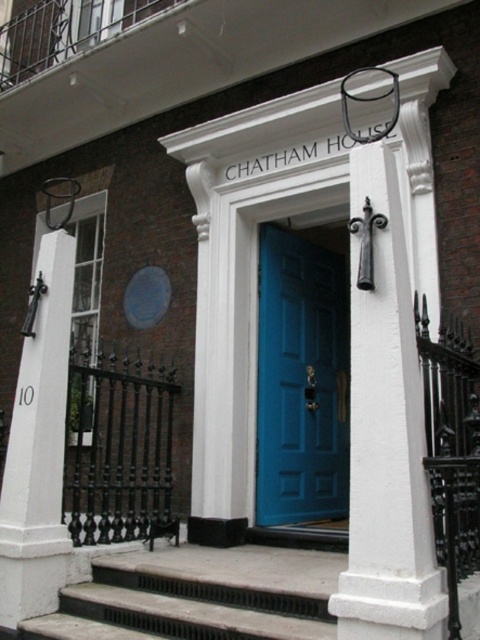
You are a delivery person with a cart that is 2 meters wide. You need to move your cart from the street to the entrance of Chatham House. The entrance has a blue door framed by white columns. There is a white painted wood at center and a white stone post at left. Can your cart fit through the space between these two objects?

The white painted wood at center is 2.55 meters from the white stone post at left. Since your cart is 2 meters wide, it can fit through the space between them as the distance is greater than the cart width.